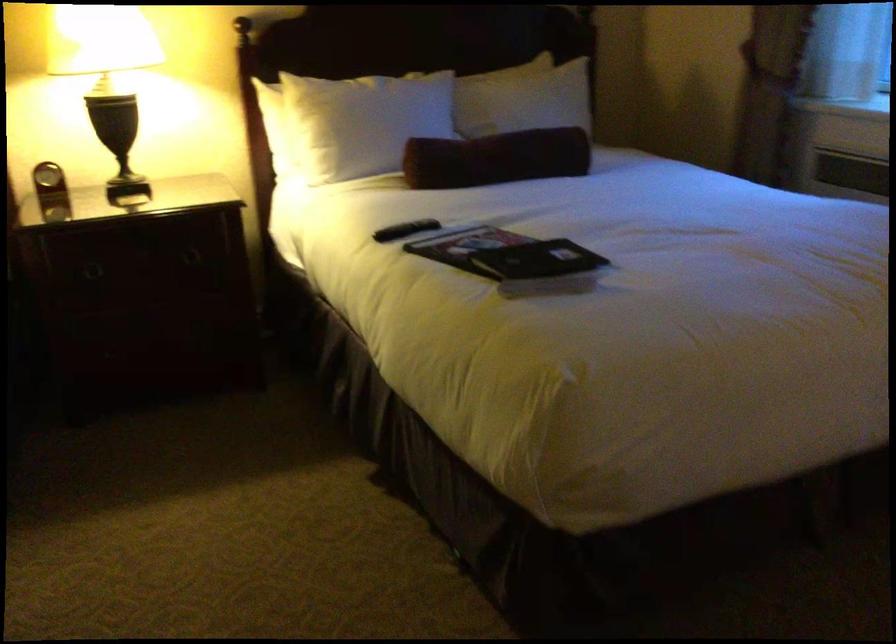
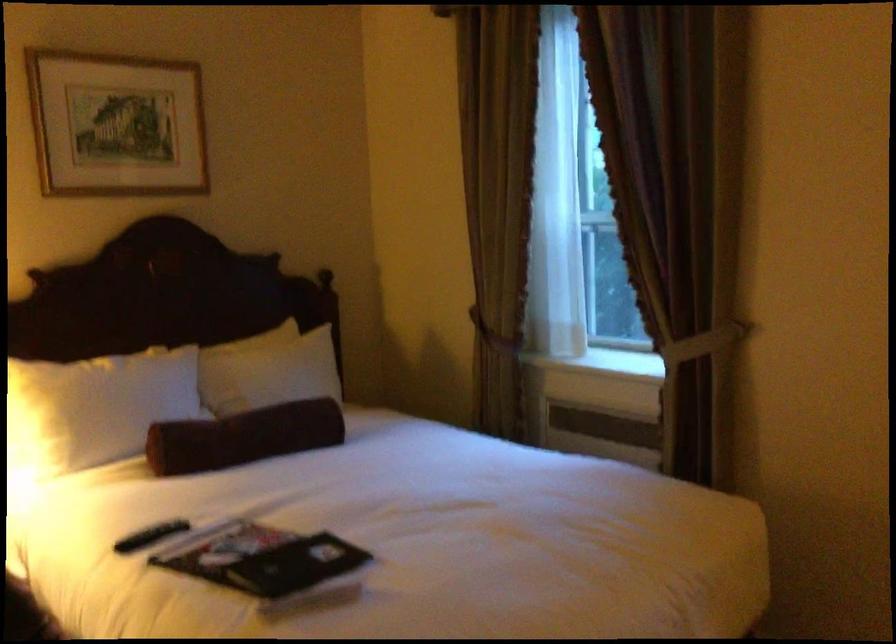
The point at (403, 229) is marked in the first image. Where is the corresponding point in the second image?

(151, 536)